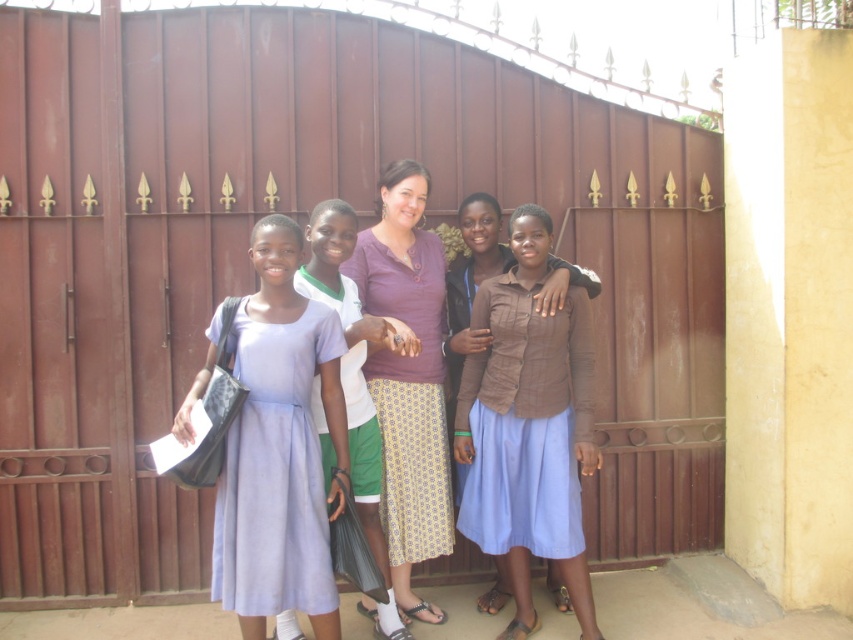
You are a photographer trying to arrange the group for a photo. You notice the lavender satin dress at center and the purple textured shirt at center. Which one should you move to the right to create more balance?

The lavender satin dress at center is positioned on the left side of the purple textured shirt at center. To create balance, move the lavender satin dress at center to the right side of the purple textured shirt at center.

You are a photographer trying to frame a group photo. You notice two people wearing shirts with different textures and colors in the center of the image. The brown textured shirt at center and the purple textured shirt at center. Which shirt is shorter in height?

The brown textured shirt at center has a lesser height compared to the purple textured shirt at center, so the brown textured shirt at center is shorter in height.

You are a photographer standing 10 feet away from the lavender satin dress at center. You want to take a photo of the group so that everyone is in focus. The camera you are using has a depth of field that can cover 10 feet. Can you capture the entire group in focus without moving?

The group members are 13.11 feet apart, which exceeds the camera depth of field of 10 feet. Therefore, you cannot capture the entire group in focus without moving.